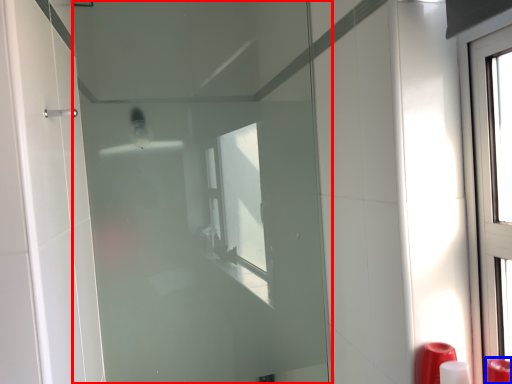
Question: Which object is closer to the camera taking this photo, door (highlighted by a red box) or soap dispenser (highlighted by a blue box)?

Choices:
 (A) door
 (B) soap dispenser

Answer: (B)